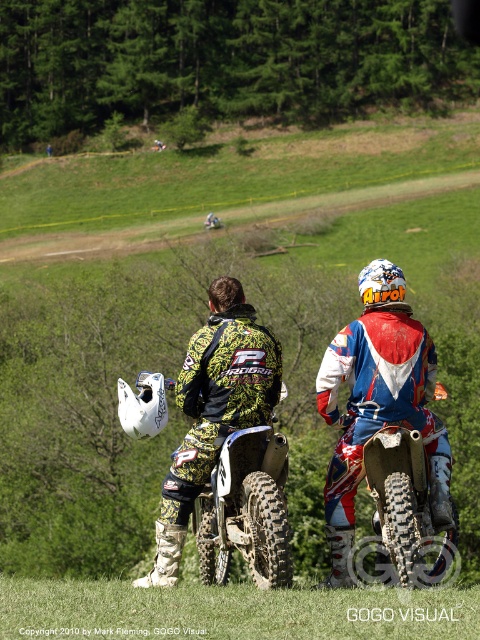
Question: Does green grass at lower center lie behind camouflage fabric jacket at center?

Choices:
 (A) yes
 (B) no

Answer: (B)

Question: Observing the image, what is the correct spatial positioning of camouflage-patterned dirt bike at center in reference to camouflage fabric jacket at center?

Choices:
 (A) below
 (B) above

Answer: (B)

Question: Is green grass at lower center to the right of camouflage fabric jacket at center from the viewer's perspective?

Choices:
 (A) no
 (B) yes

Answer: (A)

Question: Which point is farther from the camera taking this photo?

Choices:
 (A) [346, 472]
 (B) [180, 483]
 (C) [291, 612]
 (D) [252, 342]

Answer: (D)

Question: Considering the real-world distances, which object is farthest from the red and white motocross bike at center?

Choices:
 (A) green grass at lower center
 (B) camouflage fabric jacket at center
 (C) camouflage-patterned dirt bike at center

Answer: (A)

Question: Considering the real-world distances, which object is farthest from the camouflage fabric jacket at center?

Choices:
 (A) green grass at lower center
 (B) camouflage-patterned dirt bike at center

Answer: (A)